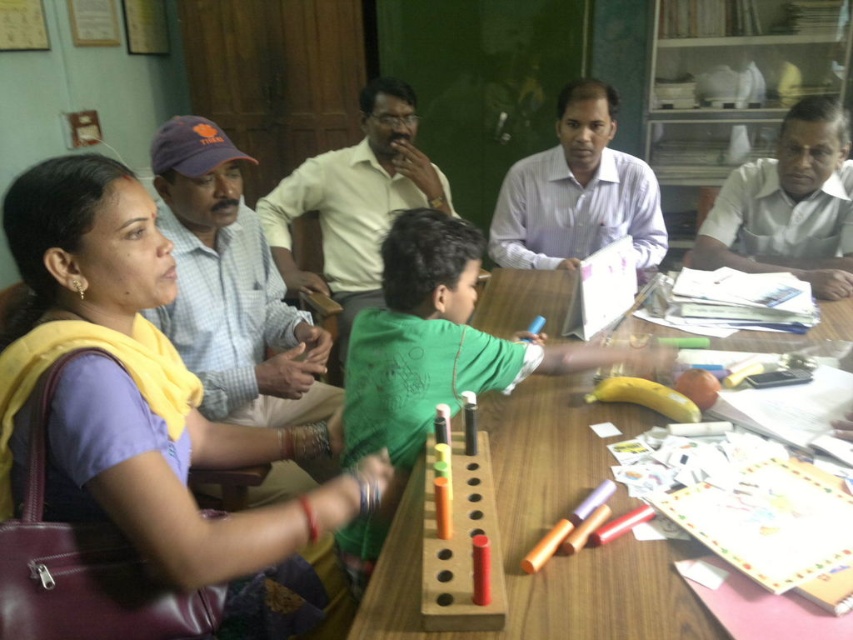
Question: Which of the following is the closest to the observer?

Choices:
 (A) wooden at center
 (B) white glossy shirt at upper right
 (C) light yellow shirt at center
 (D) matte yellow scarf at upper left

Answer: (A)

Question: Can you confirm if white striped shirt at center is positioned above white glossy shirt at upper right?

Choices:
 (A) yes
 (B) no

Answer: (A)

Question: Does matte yellow scarf at upper left appear on the left side of white glossy shirt at upper right?

Choices:
 (A) no
 (B) yes

Answer: (B)

Question: Which point is closer to the camera?

Choices:
 (A) (843, 195)
 (B) (265, 202)
 (C) (630, 163)
 (D) (86, 163)

Answer: (D)

Question: Which point is farther to the camera?

Choices:
 (A) wooden at center
 (B) light blue shirt at left
 (C) matte yellow scarf at upper left
 (D) white glossy shirt at upper right

Answer: (D)

Question: Can you confirm if light yellow shirt at center is positioned to the left of white glossy shirt at upper right?

Choices:
 (A) no
 (B) yes

Answer: (B)